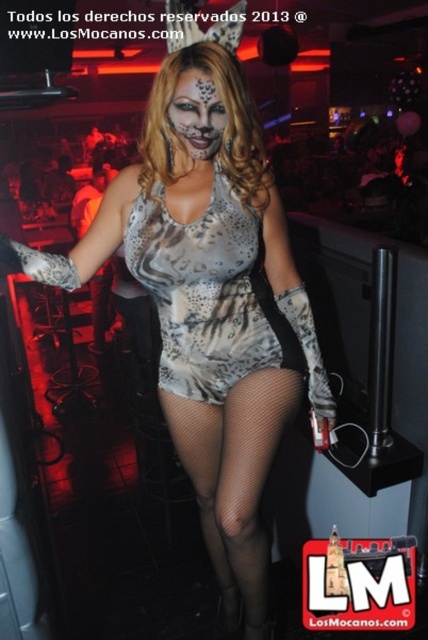
Describe the element at coordinates (219, 300) in the screenshot. I see `satin leopard print dress at center` at that location.

Can you confirm if satin leopard print dress at center is positioned to the left of fishnet stockings at lower center?

Yes, satin leopard print dress at center is to the left of fishnet stockings at lower center.

Where is `satin leopard print dress at center`? The height and width of the screenshot is (640, 428). satin leopard print dress at center is located at coordinates (219, 300).

The height and width of the screenshot is (640, 428). I want to click on satin leopard print dress at center, so click(219, 300).

Can you confirm if silver metallic dress at center is shorter than fishnet stockings at lower center?

In fact, silver metallic dress at center may be taller than fishnet stockings at lower center.

Is silver metallic dress at center below fishnet stockings at lower center?

No, silver metallic dress at center is not below fishnet stockings at lower center.

Identify the location of silver metallic dress at center. This screenshot has height=640, width=428. (211, 314).

Is fishnet stockings at lower center smaller than matte silver paint at center?

Incorrect, fishnet stockings at lower center is not smaller in size than matte silver paint at center.

Does fishnet stockings at lower center appear under matte silver paint at center?

Correct, fishnet stockings at lower center is located below matte silver paint at center.

Describe the element at coordinates (234, 483) in the screenshot. I see `fishnet stockings at lower center` at that location.

Find the location of a particular element. The width and height of the screenshot is (428, 640). fishnet stockings at lower center is located at coordinates (234, 483).